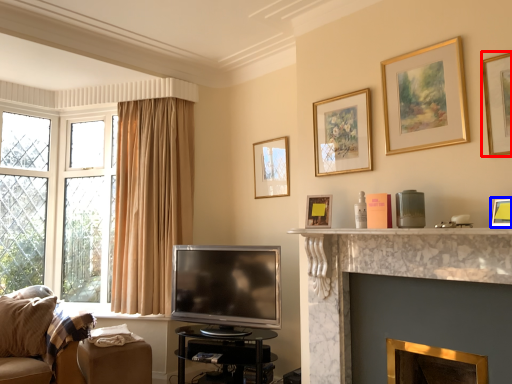
Question: Which object appears farthest to the camera in this image, picture frame (highlighted by a red box) or picture frame (highlighted by a blue box)?

Choices:
 (A) picture frame
 (B) picture frame

Answer: (A)